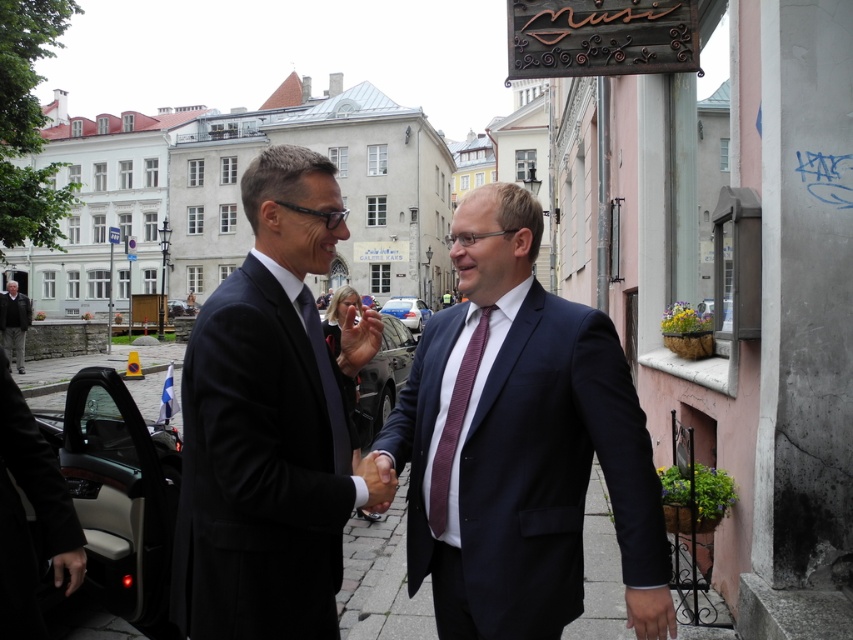
Is dark blue suit at center above glossy black car at center?

Indeed, dark blue suit at center is positioned over glossy black car at center.

Is dark blue suit at center positioned behind glossy black car at center?

That is False.

Find the location of a particular element. This screenshot has width=853, height=640. dark blue suit at center is located at coordinates (271, 422).

Between dark blue suit at center and matte black suit at center, which one appears on the right side from the viewer's perspective?

dark blue suit at center is more to the right.

Is dark blue suit at center to the left of matte black suit at center from the viewer's perspective?

In fact, dark blue suit at center is to the right of matte black suit at center.

Who is more distant from viewer, (x=219, y=397) or (x=190, y=301)?

Point (x=190, y=301)

I want to click on dark blue suit at center, so click(x=271, y=422).

Between point (544, 618) and point (170, 532), which one is positioned in front?

Positioned in front is point (544, 618).

Where is `navy blue suit at center`? navy blue suit at center is located at coordinates pyautogui.click(x=520, y=444).

Locate an element on the screen. This screenshot has width=853, height=640. navy blue suit at center is located at coordinates (520, 444).